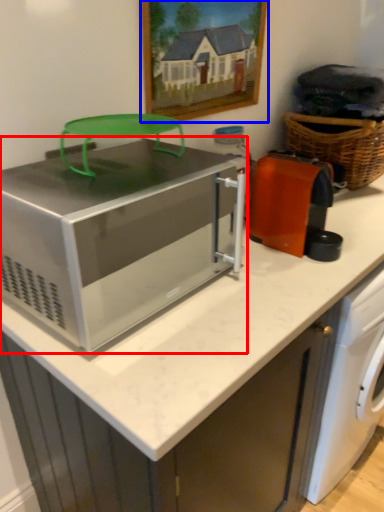
Question: Which of the following is the farthest to the observer, home appliance (highlighted by a red box) or picture frame (highlighted by a blue box)?

Choices:
 (A) home appliance
 (B) picture frame

Answer: (B)